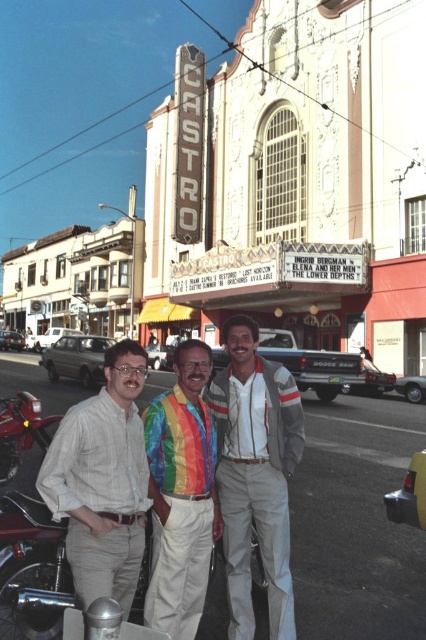
Does light beige shirt at center lie in front of shiny red motorcycle at lower left?

Yes, light beige shirt at center is in front of shiny red motorcycle at lower left.

Can you confirm if light beige shirt at center is positioned to the right of shiny red motorcycle at lower left?

Yes, light beige shirt at center is to the right of shiny red motorcycle at lower left.

Locate an element on the screen. This screenshot has width=426, height=640. light beige shirt at center is located at coordinates (103, 481).

Is point (238, 518) positioned before point (184, 420)?

No, (238, 518) is further to viewer.

Who is more forward, (267, 429) or (206, 486)?

Point (206, 486) is in front.

The height and width of the screenshot is (640, 426). What are the coordinates of `rainbow tie at center` in the screenshot? It's located at (256, 474).

Which is below, rainbow tie at center or shiny red motorcycle at lower left?

shiny red motorcycle at lower left is lower down.

Is rainbow tie at center bigger than shiny red motorcycle at lower left?

Actually, rainbow tie at center might be smaller than shiny red motorcycle at lower left.

What are the coordinates of `rainbow tie at center` in the screenshot? It's located at (256, 474).

Find the location of a particular element. rainbow tie at center is located at coordinates (256, 474).